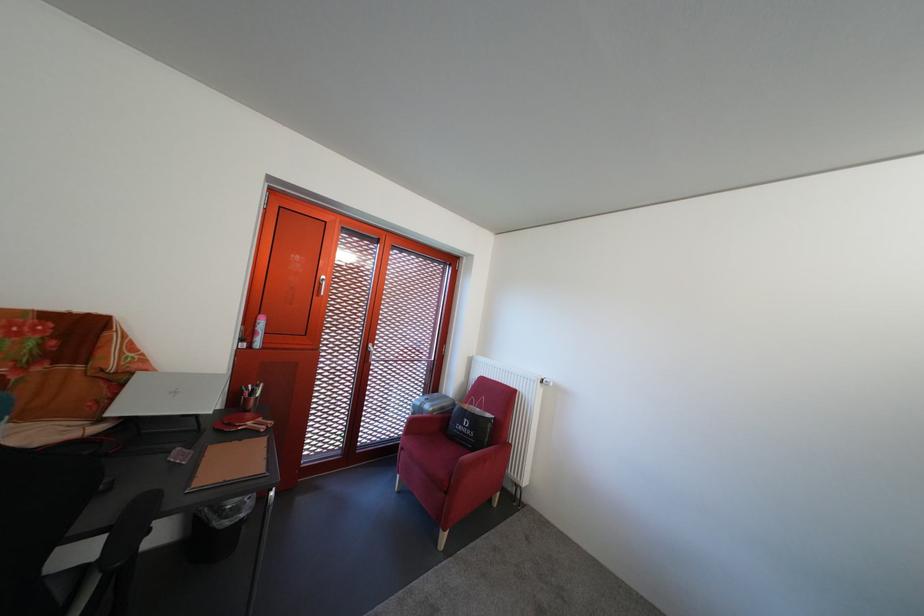
Where would you sit the red chair sitting surface? Please return your answer as a coordinate pair (x, y).

(434, 448)